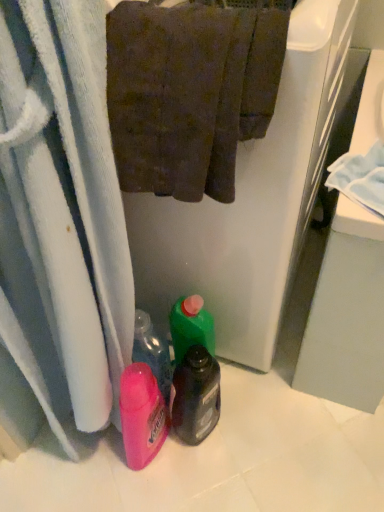
What do you see at coordinates (191, 91) in the screenshot? The image size is (384, 512). I see `brown textured towel at upper center` at bounding box center [191, 91].

This screenshot has width=384, height=512. I want to click on brown textured towel at upper center, so click(x=191, y=91).

Measure the distance between brown textured towel at upper center and camera.

They are 20.42 inches apart.

In order to face brown textured towel at upper center, should I rotate leftwards or rightwards?

You should look left and rotate roughly 0.275 degrees.

What is the approximate width of translucent plastic bottle at center?

translucent plastic bottle at center is 5.45 inches wide.

What do you see at coordinates (195, 396) in the screenshot? I see `translucent plastic bottle at center` at bounding box center [195, 396].

I want to click on translucent plastic bottle at center, so click(x=195, y=396).

Image resolution: width=384 pixels, height=512 pixels. In order to click on brown textured towel at upper center in this screenshot , I will do [191, 91].

Is translucent plastic bottle at center at the right side of brown textured towel at upper center?

Correct, you'll find translucent plastic bottle at center to the right of brown textured towel at upper center.

Which object is more forward, translucent plastic bottle at center or brown textured towel at upper center?

brown textured towel at upper center is closer to the camera.

Considering the positions of point (202, 433) and point (179, 194), is point (202, 433) closer or farther from the camera than point (179, 194)?

Point (202, 433) is positioned farther from the camera compared to point (179, 194).

From the image's perspective, which is above, translucent plastic bottle at center or brown textured towel at upper center?

brown textured towel at upper center, from the image's perspective.

From a real-world perspective, which object stands above the other?

brown textured towel at upper center.

Can you confirm if translucent plastic bottle at center is wider than brown textured towel at upper center?

Incorrect, the width of translucent plastic bottle at center does not surpass that of brown textured towel at upper center.

Between translucent plastic bottle at center and brown textured towel at upper center, which one has more height?

translucent plastic bottle at center is taller.

Does translucent plastic bottle at center have a smaller size compared to brown textured towel at upper center?

Correct, translucent plastic bottle at center occupies less space than brown textured towel at upper center.

Is translucent plastic bottle at center not inside brown textured towel at upper center?

Yes.

Is translucent plastic bottle at center not near brown textured towel at upper center?

translucent plastic bottle at center is near brown textured towel at upper center, not far away.

Is translucent plastic bottle at center oriented towards brown textured towel at upper center?

No.

How many degrees apart are the facing directions of translucent plastic bottle at center and brown textured towel at upper center?

2.85e-05 degrees separate the facing orientations of translucent plastic bottle at center and brown textured towel at upper center.

How far apart are translucent plastic bottle at center and brown textured towel at upper center?

18.85 inches.

The height and width of the screenshot is (512, 384). Identify the location of bottle on the right of the brown textured towel at upper center. (195, 396).

Does brown textured towel at upper center appear on the left side of translucent plastic bottle at center?

Yes.

Which object is closer to the camera taking this photo, brown textured towel at upper center or translucent plastic bottle at center?

Positioned in front is brown textured towel at upper center.

Is point (284, 27) closer or farther from the camera than point (209, 367)?

Point (284, 27) is closer to the camera than point (209, 367).

From the image's perspective, which one is positioned lower, brown textured towel at upper center or translucent plastic bottle at center?

translucent plastic bottle at center appears lower in the image.

From a real-world perspective, which object rests below the other?

translucent plastic bottle at center.

Considering the relative sizes of brown textured towel at upper center and translucent plastic bottle at center in the image provided, is brown textured towel at upper center thinner than translucent plastic bottle at center?

In fact, brown textured towel at upper center might be wider than translucent plastic bottle at center.

Considering the relative sizes of brown textured towel at upper center and translucent plastic bottle at center in the image provided, is brown textured towel at upper center taller than translucent plastic bottle at center?

No.

Considering the sizes of objects brown textured towel at upper center and translucent plastic bottle at center in the image provided, who is bigger, brown textured towel at upper center or translucent plastic bottle at center?

brown textured towel at upper center.

Is translucent plastic bottle at center surrounded by brown textured towel at upper center?

Actually, translucent plastic bottle at center is outside brown textured towel at upper center.

Can you see brown textured towel at upper center touching translucent plastic bottle at center?

brown textured towel at upper center and translucent plastic bottle at center are not in contact.

Could you tell me if brown textured towel at upper center is facing translucent plastic bottle at center?

No, brown textured towel at upper center is not oriented towards translucent plastic bottle at center.

In order to click on towel positioned vertically above the translucent plastic bottle at center (from a real-world perspective) in this screenshot , I will do `click(191, 91)`.

This screenshot has height=512, width=384. I want to click on bottle located on the right of brown textured towel at upper center, so click(x=195, y=396).

Identify the location of bottle below the brown textured towel at upper center (from the image's perspective). (195, 396).